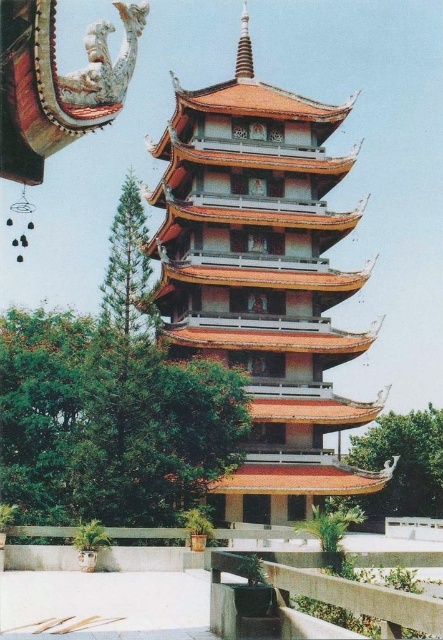
Question: Considering the relative positions of orange tiled tower at center and concrete/rough rail at lower center in the image provided, where is orange tiled tower at center located with respect to concrete/rough rail at lower center?

Choices:
 (A) left
 (B) right

Answer: (A)

Question: Which object is farther from the camera taking this photo?

Choices:
 (A) concrete/rough rail at lower center
 (B) orange tiled tower at center

Answer: (B)

Question: Does orange tiled tower at center have a larger size compared to concrete/rough rail at lower center?

Choices:
 (A) no
 (B) yes

Answer: (B)

Question: Can you confirm if orange tiled tower at center is positioned to the right of concrete/rough rail at lower center?

Choices:
 (A) no
 (B) yes

Answer: (A)

Question: Which point is farther to the camera?

Choices:
 (A) concrete/rough rail at lower center
 (B) orange tiled tower at center

Answer: (B)